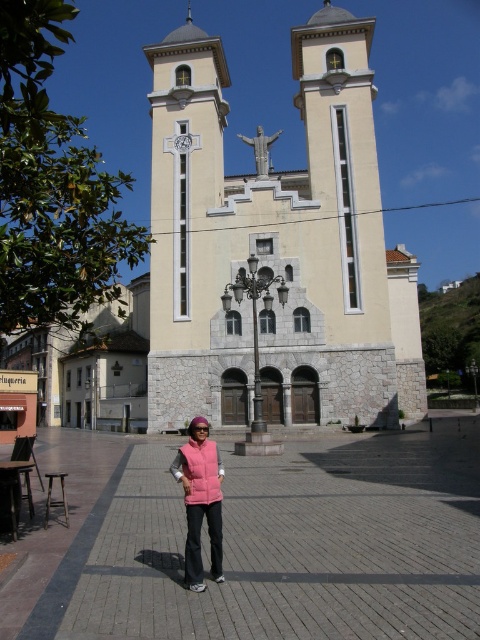
Question: Among these points, which one is farthest from the camera?

Choices:
 (A) (323, 4)
 (B) (182, 460)

Answer: (A)

Question: Which point is farther from the camera taking this photo?

Choices:
 (A) click(195, 509)
 (B) click(220, 461)

Answer: (B)

Question: Does pink quilted vest at center lie behind pink fleece vest at center?

Choices:
 (A) no
 (B) yes

Answer: (A)

Question: Can you confirm if pink quilted vest at center is bigger than pink fleece vest at center?

Choices:
 (A) no
 (B) yes

Answer: (B)

Question: Estimate the real-world distances between objects in this image. Which object is closer to the beige stone church at center?

Choices:
 (A) pink fleece vest at center
 (B) pink quilted vest at center

Answer: (B)

Question: Is beige stone church at center positioned before pink fleece vest at center?

Choices:
 (A) no
 (B) yes

Answer: (A)